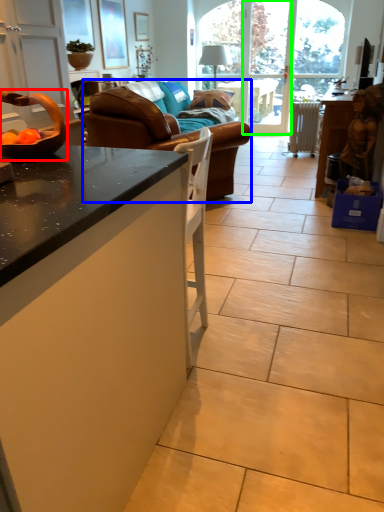
Question: Which object is the closest to the bowl (highlighted by a red box)? Choose among these: studio couch (highlighted by a blue box) or screen door (highlighted by a green box).

Choices:
 (A) studio couch
 (B) screen door

Answer: (A)